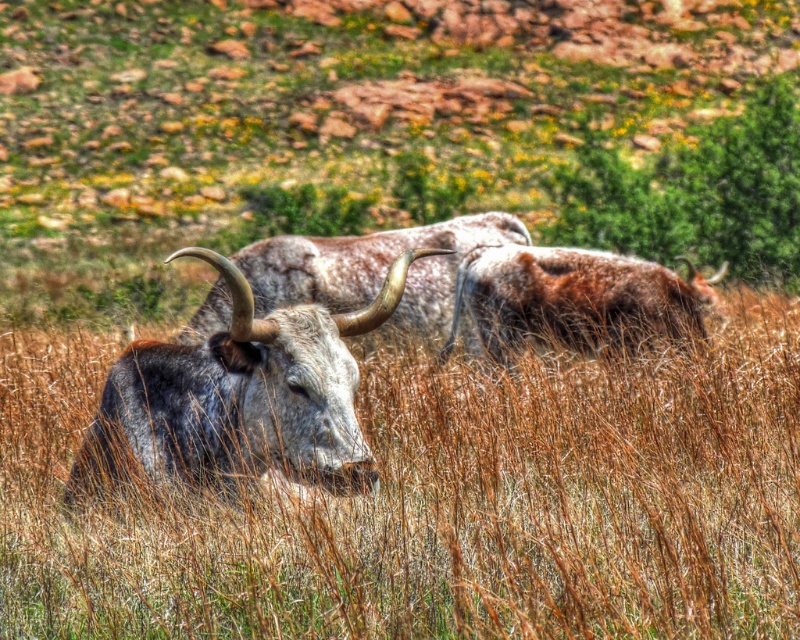
Question: Which point appears closest to the camera in this image?

Choices:
 (A) (84, 412)
 (B) (516, 241)
 (C) (341, 392)

Answer: (C)

Question: Is the position of speckled gray cow at center more distant than that of speckled fur yak at center?

Choices:
 (A) no
 (B) yes

Answer: (A)

Question: Which object appears farthest from the camera in this image?

Choices:
 (A) brown grass at center
 (B) speckled gray cow at center
 (C) speckled fur yak at center
 (D) brown fuzzy yak at center

Answer: (C)

Question: Is brown grass at center bigger than speckled fur yak at center?

Choices:
 (A) yes
 (B) no

Answer: (B)

Question: Which of the following is the closest to the observer?

Choices:
 (A) brown fuzzy yak at center
 (B) brown grass at center
 (C) speckled gray cow at center

Answer: (C)

Question: Can you confirm if speckled gray cow at center is thinner than brown fuzzy yak at center?

Choices:
 (A) no
 (B) yes

Answer: (B)